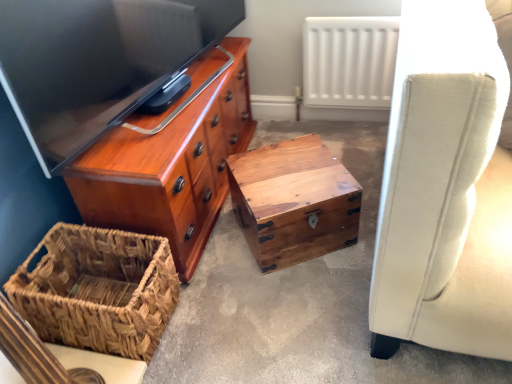
What is the approximate width of natural wood trunk at center?

It is 13.77 inches.

I want to click on woven brown picnic basket at lower left, so click(98, 290).

Locate an element on the screen. This screenshot has width=512, height=384. white matte radiator at upper center is located at coordinates (349, 61).

Describe the element at coordinates (172, 163) in the screenshot. I see `shiny wood chest of drawers at upper left` at that location.

You are a GUI agent. You are given a task and a screenshot of the screen. Output one action in this format:
    pyautogui.click(x=<x>, y=<y>)
    Task: Click on the natural wood trunk at center
    The image size is (512, 384).
    Given the screenshot: What is the action you would take?
    pyautogui.click(x=294, y=201)

Based on the photo, between shiny wood chest of drawers at upper left and woven brown picnic basket at lower left, which one is positioned in front?

woven brown picnic basket at lower left.

From a real-world perspective, is shiny wood chest of drawers at upper left located beneath woven brown picnic basket at lower left?

Incorrect, from a real-world perspective, shiny wood chest of drawers at upper left is higher than woven brown picnic basket at lower left.

Find the location of a particular element. This screenshot has width=512, height=384. the chest of drawers above the woven brown picnic basket at lower left (from the image's perspective) is located at coordinates (172, 163).

Looking at this image, does white matte radiator at upper center come behind woven brown picnic basket at lower left?

Yes, white matte radiator at upper center is further from the camera.

Between point (366, 65) and point (87, 268), which one is positioned behind?

Positioned behind is point (366, 65).

Looking at this image, does white matte radiator at upper center have a greater width compared to woven brown picnic basket at lower left?

Incorrect, the width of white matte radiator at upper center does not surpass that of woven brown picnic basket at lower left.

Between white matte radiator at upper center and woven brown picnic basket at lower left, which one appears on the left side from the viewer's perspective?

woven brown picnic basket at lower left is more to the left.

Looking at this image, from a real-world perspective, who is located lower, white matte radiator at upper center or shiny wood chest of drawers at upper left?

In real-world perspective, shiny wood chest of drawers at upper left is lower.

Which of these two, white matte radiator at upper center or shiny wood chest of drawers at upper left, is wider?

With larger width is shiny wood chest of drawers at upper left.

In the image, is white matte radiator at upper center positioned in front of or behind shiny wood chest of drawers at upper left?

white matte radiator at upper center is positioned farther from the viewer than shiny wood chest of drawers at upper left.

Could you tell me if white matte radiator at upper center is turned towards shiny wood chest of drawers at upper left?

No, white matte radiator at upper center is not aimed at shiny wood chest of drawers at upper left.

From the image's perspective, which object appears higher, wooden chest at center or shiny wood chest of drawers at upper left?

From the image's view, shiny wood chest of drawers at upper left is above.

From a real-world perspective, which object stands above the other?

From a 3D spatial view, shiny wood chest of drawers at upper left is above.

Which object is wider, wooden chest at center or shiny wood chest of drawers at upper left?

Wider between the two is wooden chest at center.

Looking at this image, from the image's perspective, relative to wooden chest at center, is woven brown picnic basket at lower left above or below?

Based on their image positions, woven brown picnic basket at lower left is located beneath wooden chest at center.

Is woven brown picnic basket at lower left thinner than wooden chest at center?

Yes.

How far apart are woven brown picnic basket at lower left and wooden chest at center?

They are 13.05 inches apart.

Is point (142, 282) more distant than point (239, 319)?

No.

From the image's perspective, is natural wood trunk at center located beneath wooden chest at center?

Incorrect, from the image's perspective, natural wood trunk at center is higher than wooden chest at center.

Considering the positions of points (339, 204) and (214, 306), is point (339, 204) closer to camera compared to point (214, 306)?

That is False.

Can you confirm if natural wood trunk at center is bigger than wooden chest at center?

Actually, natural wood trunk at center might be smaller than wooden chest at center.

Between shiny wood chest of drawers at upper left and wooden chest at center, which one appears on the right side from the viewer's perspective?

wooden chest at center.

Is wooden chest at center a part of shiny wood chest of drawers at upper left?

Actually, wooden chest at center is outside shiny wood chest of drawers at upper left.

In the scene shown: From a real-world perspective, between shiny wood chest of drawers at upper left and wooden chest at center, who is vertically lower?

In real-world perspective, wooden chest at center is lower.

Is shiny wood chest of drawers at upper left far away from wooden chest at center?

shiny wood chest of drawers at upper left is actually quite close to wooden chest at center.

Where is `chest of drawers above the woven brown picnic basket at lower left (from the image's perspective)`? The image size is (512, 384). chest of drawers above the woven brown picnic basket at lower left (from the image's perspective) is located at coordinates (172, 163).

Where is `picnic basket lying in front of the white matte radiator at upper center`? This screenshot has height=384, width=512. picnic basket lying in front of the white matte radiator at upper center is located at coordinates (98, 290).

Estimate the real-world distances between objects in this image. Which object is closer to woven brown picnic basket at lower left, natural wood trunk at center or wooden chest at center?

Among the two, wooden chest at center is located nearer to woven brown picnic basket at lower left.

Estimate the real-world distances between objects in this image. Which object is further from white matte radiator at upper center, shiny wood chest of drawers at upper left or wooden chest at center?

shiny wood chest of drawers at upper left lies further to white matte radiator at upper center than the other object.

Considering their positions, is white matte radiator at upper center positioned closer to wooden chest at center than woven brown picnic basket at lower left?

Among the two, woven brown picnic basket at lower left is located nearer to wooden chest at center.

Which object lies further to the anchor point natural wood trunk at center, shiny wood chest of drawers at upper left or white matte radiator at upper center?

white matte radiator at upper center is further to natural wood trunk at center.

Which object lies nearer to the anchor point natural wood trunk at center, shiny wood chest of drawers at upper left or woven brown picnic basket at lower left?

shiny wood chest of drawers at upper left is closer to natural wood trunk at center.

Looking at the image, which one is located further to wooden chest at center, white matte radiator at upper center or natural wood trunk at center?

white matte radiator at upper center is further to wooden chest at center.

When comparing their distances from natural wood trunk at center, does woven brown picnic basket at lower left or wooden chest at center seem further?

woven brown picnic basket at lower left is further to natural wood trunk at center.

From the image, which object appears to be nearer to shiny wood chest of drawers at upper left, wooden chest at center or natural wood trunk at center?

Among the two, natural wood trunk at center is located nearer to shiny wood chest of drawers at upper left.

Locate an element on the screen. table between shiny wood chest of drawers at upper left and white matte radiator at upper center from left to right is located at coordinates (294, 201).

Locate an element on the screen. The height and width of the screenshot is (384, 512). concrete located between shiny wood chest of drawers at upper left and natural wood trunk at center in the left-right direction is located at coordinates (298, 300).

Where is `the chest of drawers located between wooden chest at center and white matte radiator at upper center in the depth direction`? The height and width of the screenshot is (384, 512). the chest of drawers located between wooden chest at center and white matte radiator at upper center in the depth direction is located at coordinates (172, 163).

Locate an element on the screen. The height and width of the screenshot is (384, 512). table between woven brown picnic basket at lower left and white matte radiator at upper center is located at coordinates (294, 201).